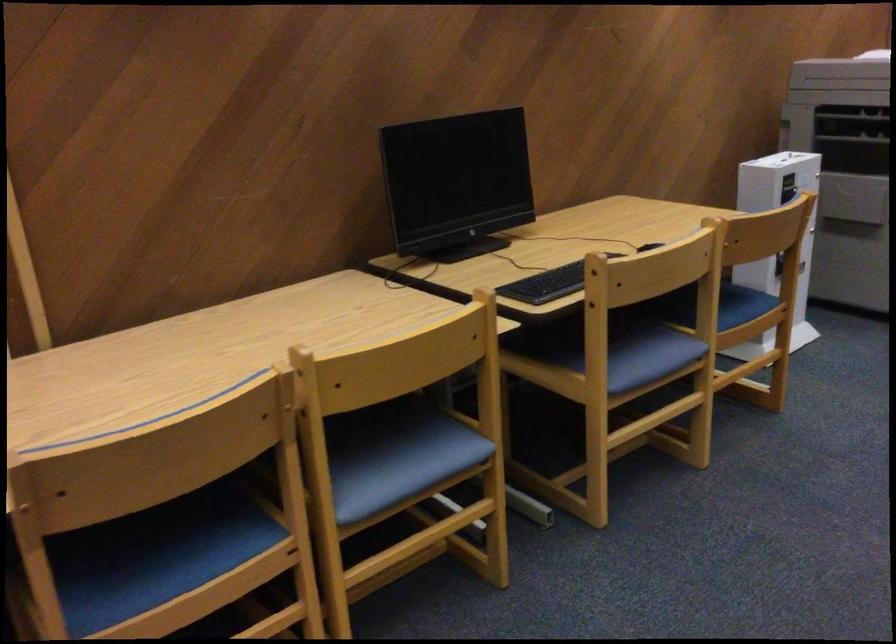
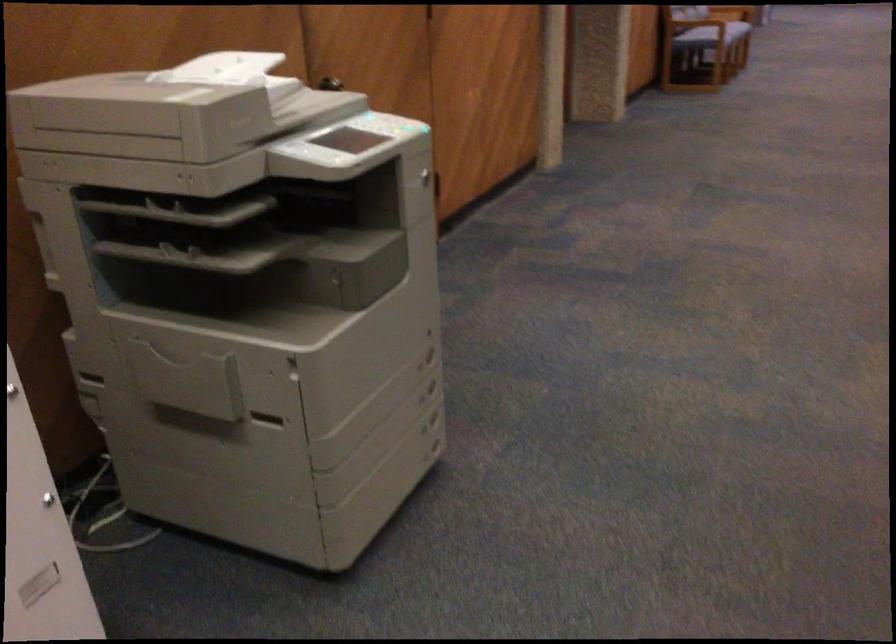
Which direction would the cameraman need to move to produce the second image?

The cameraman walked toward right, forward.